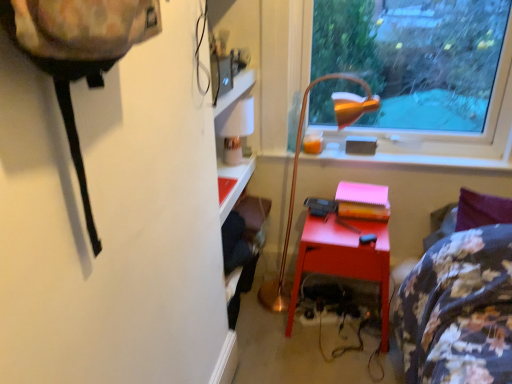
Question: Visually, is gold metallic floor lamp at center positioned to the left or to the right of transparent glass window at upper right?

Choices:
 (A) right
 (B) left

Answer: (B)

Question: From the image's perspective, is gold metallic floor lamp at center located above or below transparent glass window at upper right?

Choices:
 (A) below
 (B) above

Answer: (A)

Question: Considering the real-world distances, which object is farthest from the transparent glass window at upper right?

Choices:
 (A) matte red desk at center
 (B) matte orange lampshade at upper center
 (C) gold metallic floor lamp at center

Answer: (A)

Question: Which object is the closest to the transparent glass window at upper right?

Choices:
 (A) gold metallic floor lamp at center
 (B) matte red desk at center
 (C) matte orange lampshade at upper center

Answer: (C)